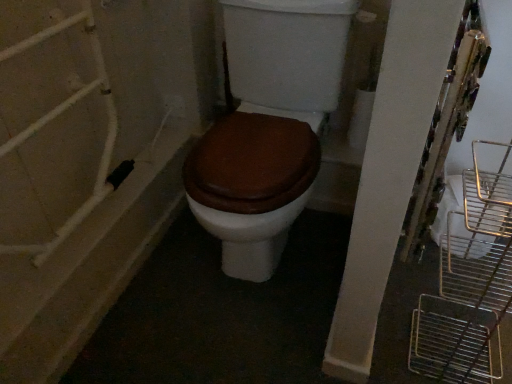
The width and height of the screenshot is (512, 384). What do you see at coordinates (90, 159) in the screenshot?
I see `black plastic plug at lower left` at bounding box center [90, 159].

In order to face black plastic plug at lower left, should I rotate leftwards or rightwards?

A 18.634 degree turn to the left will do.

Measure the distance between black plastic plug at lower left and camera.

black plastic plug at lower left and camera are 34.34 inches apart.

The height and width of the screenshot is (384, 512). In order to click on black plastic plug at lower left in this screenshot , I will do `click(90, 159)`.

This screenshot has height=384, width=512. Identify the location of brown matte toilet at center. (270, 125).

The width and height of the screenshot is (512, 384). Describe the element at coordinates (270, 125) in the screenshot. I see `brown matte toilet at center` at that location.

Find the location of `black plastic plug at lower left`. black plastic plug at lower left is located at coordinates (90, 159).

Which object is positioned more to the right, brown matte toilet at center or black plastic plug at lower left?

From the viewer's perspective, brown matte toilet at center appears more on the right side.

Based on the photo, which is behind, brown matte toilet at center or black plastic plug at lower left?

black plastic plug at lower left.

Considering the points (190, 194) and (137, 72), which point is in front, point (190, 194) or point (137, 72)?

Point (190, 194)

From the image's perspective, is brown matte toilet at center beneath black plastic plug at lower left?

Incorrect, from the image's perspective, brown matte toilet at center is higher than black plastic plug at lower left.

From the picture: From a real-world perspective, is brown matte toilet at center over black plastic plug at lower left?

Yes, from a real-world perspective, brown matte toilet at center is above black plastic plug at lower left.

Considering the sizes of objects brown matte toilet at center and black plastic plug at lower left in the image provided, who is wider, brown matte toilet at center or black plastic plug at lower left?

Wider between the two is black plastic plug at lower left.

Between brown matte toilet at center and black plastic plug at lower left, which one has more height?

With more height is brown matte toilet at center.

Can you confirm if brown matte toilet at center is smaller than black plastic plug at lower left?

No, brown matte toilet at center is not smaller than black plastic plug at lower left.

Does brown matte toilet at center contain black plastic plug at lower left?

No, brown matte toilet at center does not contain black plastic plug at lower left.

Is there a large distance between brown matte toilet at center and black plastic plug at lower left?

That's not correct — brown matte toilet at center is a little close to black plastic plug at lower left.

Is black plastic plug at lower left at the back of brown matte toilet at center?

No, brown matte toilet at center's orientation is not away from black plastic plug at lower left.

Can you tell me how much brown matte toilet at center and black plastic plug at lower left differ in facing direction?

The angular difference between brown matte toilet at center and black plastic plug at lower left is 180 degrees.

I want to click on toilet above the black plastic plug at lower left (from the image's perspective), so click(270, 125).

Based on their positions, is black plastic plug at lower left located to the left or right of brown matte toilet at center?

Clearly, black plastic plug at lower left is on the left of brown matte toilet at center in the image.

Considering their positions, is black plastic plug at lower left located in front of or behind brown matte toilet at center?

black plastic plug at lower left is positioned farther from the viewer than brown matte toilet at center.

Considering the points (175, 65) and (301, 79), which point is in front, point (175, 65) or point (301, 79)?

Positioned in front is point (301, 79).

From the image's perspective, relative to brown matte toilet at center, is black plastic plug at lower left above or below?

Based on their image positions, black plastic plug at lower left is located beneath brown matte toilet at center.

From a real-world perspective, is black plastic plug at lower left physically above brown matte toilet at center?

No, from a real-world perspective, black plastic plug at lower left is not above brown matte toilet at center.

In the scene shown: Can you confirm if black plastic plug at lower left is thinner than brown matte toilet at center?

No, black plastic plug at lower left is not thinner than brown matte toilet at center.

Between black plastic plug at lower left and brown matte toilet at center, which one has more height?

brown matte toilet at center.

Is black plastic plug at lower left smaller than brown matte toilet at center?

Indeed, black plastic plug at lower left has a smaller size compared to brown matte toilet at center.

Is black plastic plug at lower left located outside brown matte toilet at center?

Yes, black plastic plug at lower left is outside of brown matte toilet at center.

Does black plastic plug at lower left touch brown matte toilet at center?

No, black plastic plug at lower left is not touching brown matte toilet at center.

Could you tell me if black plastic plug at lower left is facing brown matte toilet at center?

No, black plastic plug at lower left is not turned towards brown matte toilet at center.

Measure the distance between black plastic plug at lower left and brown matte toilet at center.

13.89 inches.

Image resolution: width=512 pixels, height=384 pixels. I want to click on toilet located on the right of black plastic plug at lower left, so click(270, 125).

At what (x,y) coordinates should I click in order to perform the action: click on toilet located above the black plastic plug at lower left (from a real-world perspective). Please return your answer as a coordinate pair (x, y). Image resolution: width=512 pixels, height=384 pixels. Looking at the image, I should click on (270, 125).

Identify the location of toilet above the black plastic plug at lower left (from the image's perspective). point(270,125).